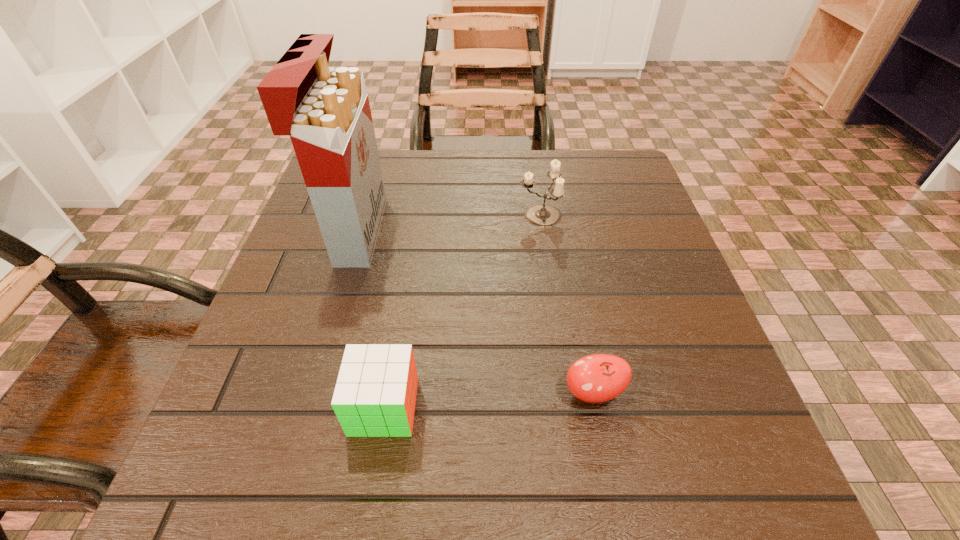
You are a GUI agent. You are given a task and a screenshot of the screen. Output one action in this format:
    pyautogui.click(x=<x>, y=<y>)
    Task: Click on the cigarette case
    This screenshot has width=960, height=540.
    Given the screenshot: What is the action you would take?
    pyautogui.click(x=325, y=110)

Identify the location of the leftmost object. The height and width of the screenshot is (540, 960). (325, 110).

At what (x,y) coordinates should I click in order to perform the action: click on the third shortest object. Please return your answer as a coordinate pair (x, y). The height and width of the screenshot is (540, 960). Looking at the image, I should click on point(541,215).

Locate an element on the screen. apple is located at coordinates (595, 378).

At what (x,y) coordinates should I click in order to perform the action: click on cube. Please return your answer as a coordinate pair (x, y). The height and width of the screenshot is (540, 960). Looking at the image, I should click on (375, 395).

Identify the location of vacant position located with the lid open on the leftmost object. (464, 231).

Locate an element on the screen. vacant area located 0.200m on the left of the second tallest object is located at coordinates [x=428, y=215].

You are a GUI agent. You are given a task and a screenshot of the screen. Output one action in this format:
    pyautogui.click(x=<x>, y=<y>)
    Task: Click on the free space located on the back of the apple
    
    Given the screenshot: What is the action you would take?
    pyautogui.click(x=566, y=260)

Where is `blank space located on the back of the second object from left to right`? The height and width of the screenshot is (540, 960). blank space located on the back of the second object from left to right is located at coordinates (408, 257).

At what (x,y) coordinates should I click in order to perform the action: click on cigarette case located in the far edge section of the desktop. Please return your answer as a coordinate pair (x, y). Looking at the image, I should click on (325, 110).